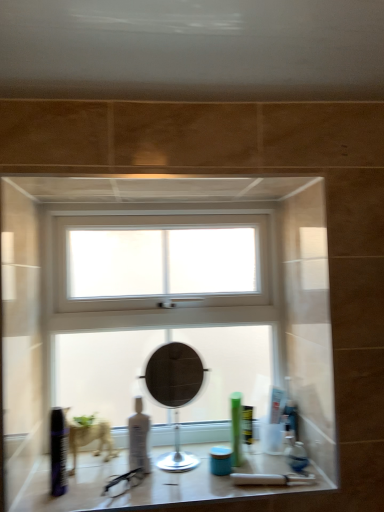
Where is `vacant area that is in front of green matte tube at center, the first toiletry when ordered from right to left`? The width and height of the screenshot is (384, 512). vacant area that is in front of green matte tube at center, the first toiletry when ordered from right to left is located at coordinates (241, 494).